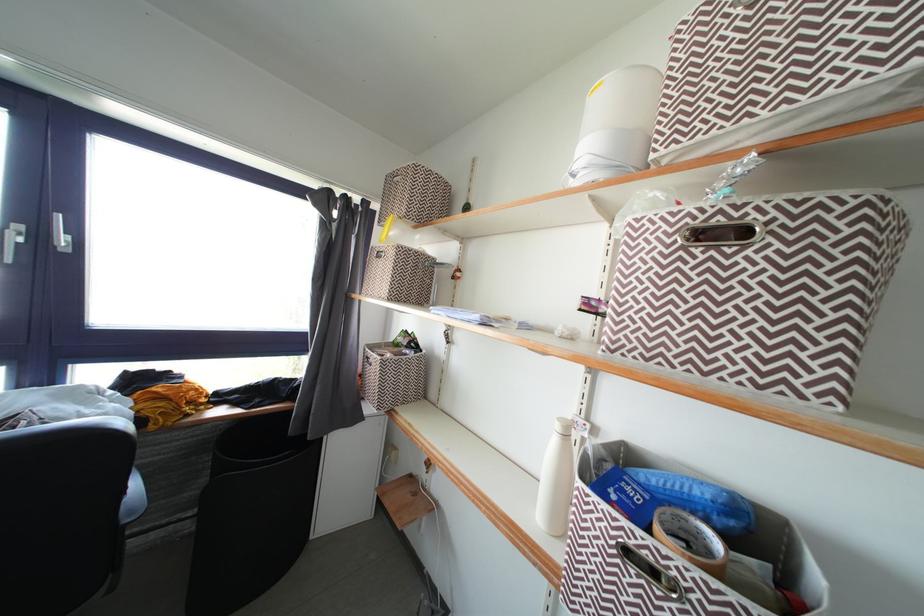
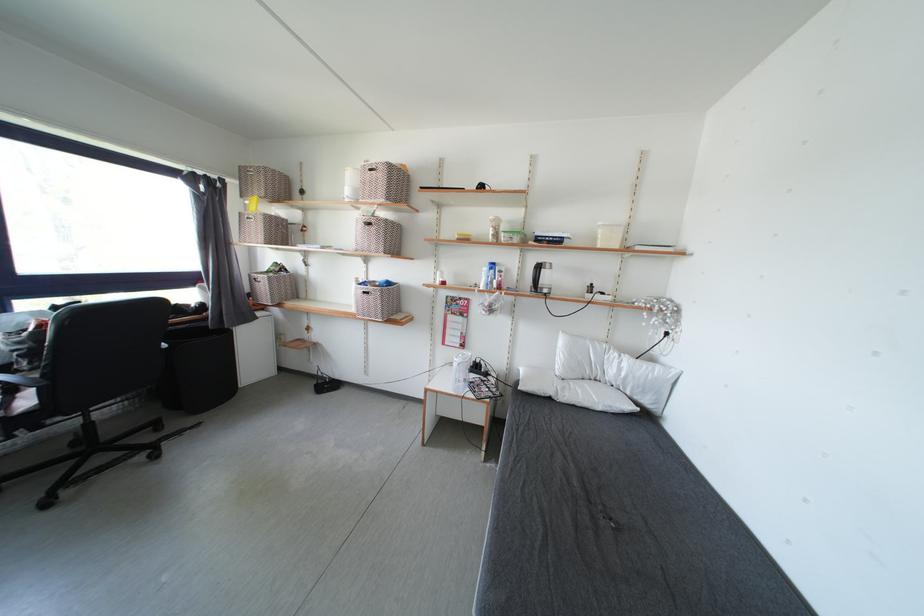
The point at (635, 557) is marked in the first image. Where is the corresponding point in the second image?

(371, 297)